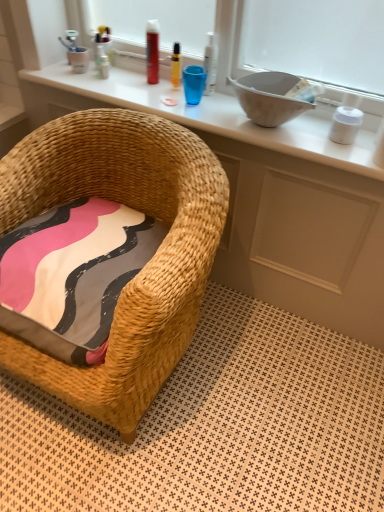
The width and height of the screenshot is (384, 512). I want to click on free space to the left of white matte container at upper right, which appears as the 5th toiletry when viewed from the left, so click(300, 139).